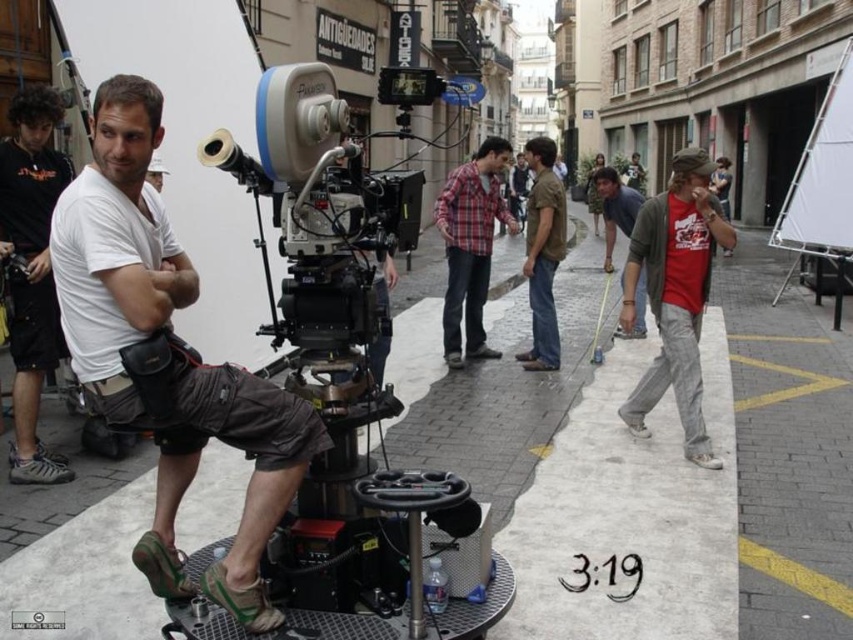
From the picture: Is silver metallic video camera at center below black fabric camera at left?

Correct, silver metallic video camera at center is located below black fabric camera at left.

Measure the distance between silver metallic video camera at center and black fabric camera at left.

silver metallic video camera at center is 9.11 feet from black fabric camera at left.

The width and height of the screenshot is (853, 640). Identify the location of silver metallic video camera at center. (322, 257).

Which is more to the right, red cotton t-shirt at right or plaid fabric shirt at center?

From the viewer's perspective, red cotton t-shirt at right appears more on the right side.

Does red cotton t-shirt at right appear under plaid fabric shirt at center?

Yes.

Describe the element at coordinates (675, 294) in the screenshot. The height and width of the screenshot is (640, 853). I see `red cotton t-shirt at right` at that location.

The height and width of the screenshot is (640, 853). In order to click on red cotton t-shirt at right in this screenshot , I will do `click(675, 294)`.

Between point (262, 464) and point (38, 344), which one is positioned behind?

The point (38, 344) is more distant.

Does white cotton shirt at center appear under black fabric camera at left?

Correct, white cotton shirt at center is located below black fabric camera at left.

Is point (115, 97) positioned behind point (16, 385)?

No, (115, 97) is in front of (16, 385).

Locate an element on the screen. white cotton shirt at center is located at coordinates (165, 355).